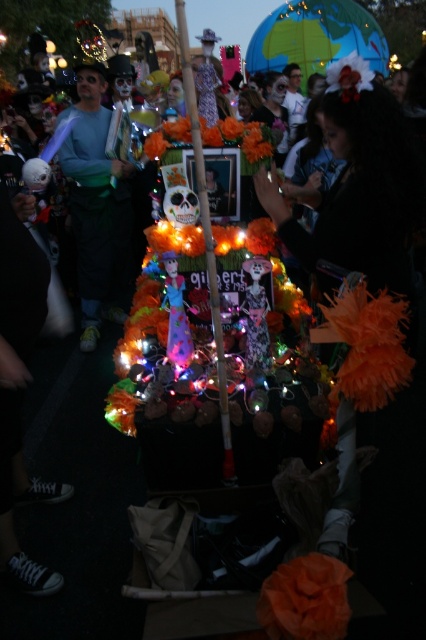
Does matte green shirt at center appear on the left side of wooden stick at center?

Yes, matte green shirt at center is to the left of wooden stick at center.

Does point (132, 216) come in front of point (181, 28)?

No.

This screenshot has width=426, height=640. Identify the location of matte green shirt at center. (97, 208).